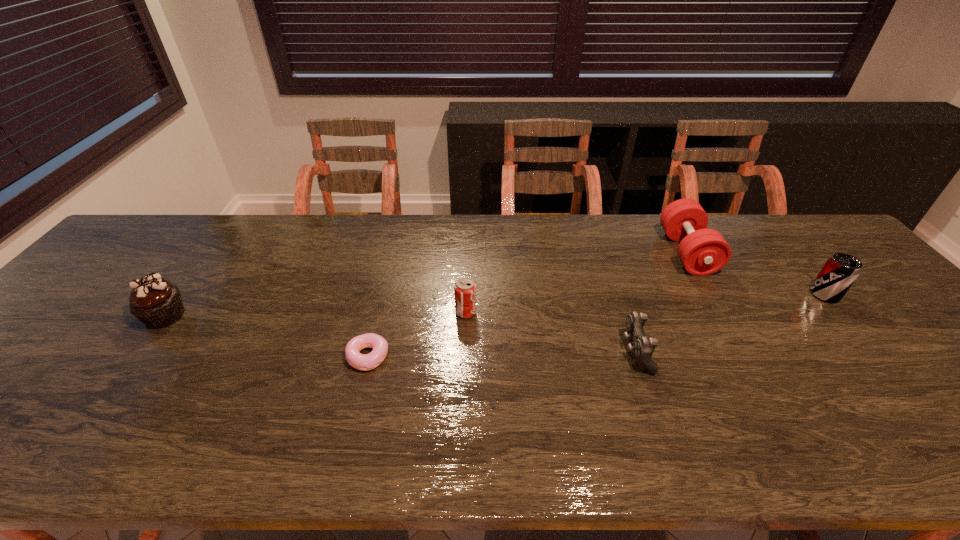
Identify the location of object located in the right edge section of the desktop. This screenshot has height=540, width=960. (840, 271).

In the image, there is a desktop. Identify the location of vacant space at the far edge. (520, 223).

Identify the location of free point at the near edge. (795, 451).

Where is `free space at the left edge of the desktop`? Image resolution: width=960 pixels, height=540 pixels. free space at the left edge of the desktop is located at coordinates (127, 264).

The width and height of the screenshot is (960, 540). I want to click on vacant space at the right edge, so click(x=870, y=308).

The width and height of the screenshot is (960, 540). Find the location of `vacant space at the far right corner`. vacant space at the far right corner is located at coordinates (785, 234).

Locate an element on the screen. unoccupied area between the shortest object and the rightmost object is located at coordinates (596, 326).

Identify the location of vacant space in between the second object from left to right and the right soda can. The height and width of the screenshot is (540, 960). (596, 326).

Locate an element on the screen. The height and width of the screenshot is (540, 960). vacant space that is in between the nearer soda can and the third object from right to left is located at coordinates (551, 332).

The height and width of the screenshot is (540, 960). I want to click on free space that is in between the shortest object and the farthest object, so click(527, 305).